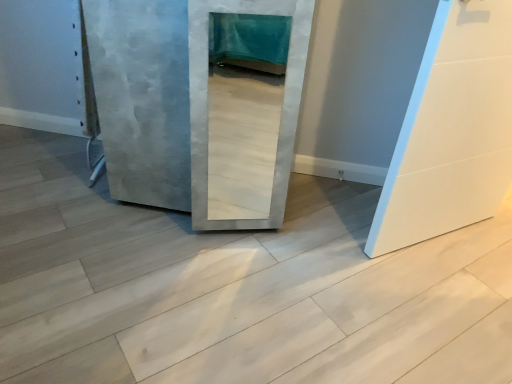
Locate an element on the screen. vacant space that is in between concrete textured door at center, which is the 2th door in right-to-left order, and white matte door at right, the second door in the left-to-right sequence is located at coordinates (329, 218).